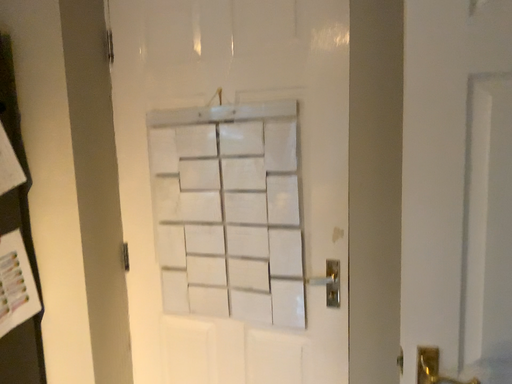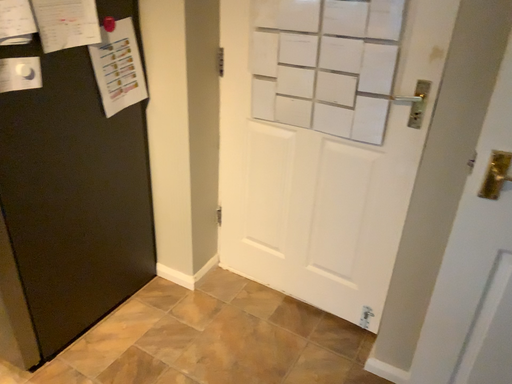
Question: Which way did the camera rotate in the video?

Choices:
 (A) rotated right
 (B) rotated left

Answer: (B)